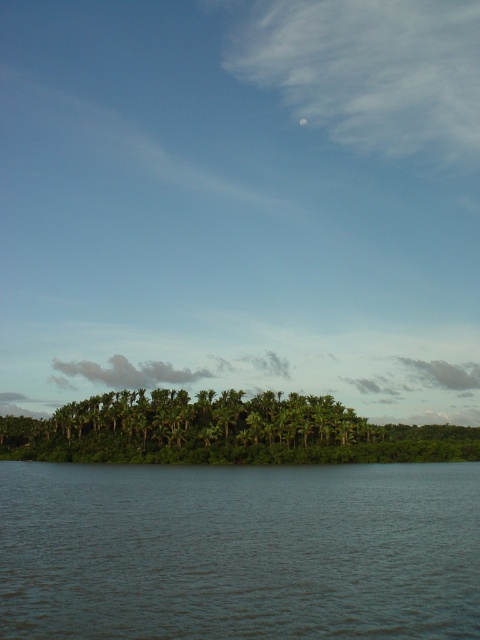
Does dark blue water at lower center appear under green leafy trees at center?

No.

Is dark blue water at lower center to the left of green leafy trees at center from the viewer's perspective?

Incorrect, dark blue water at lower center is not on the left side of green leafy trees at center.

Who is more distant from viewer, (x=368, y=467) or (x=224, y=442)?

Positioned behind is point (x=224, y=442).

I want to click on dark blue water at lower center, so click(239, 550).